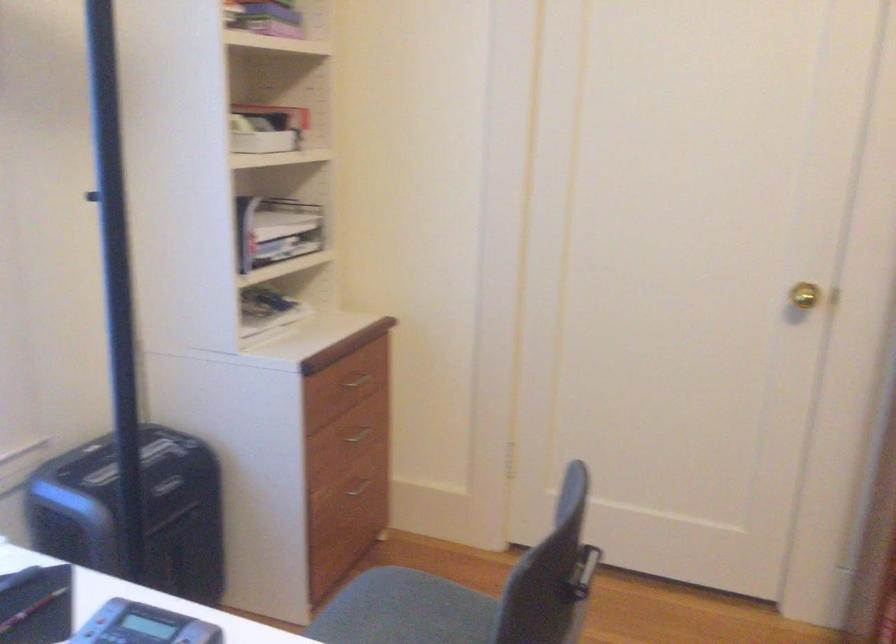
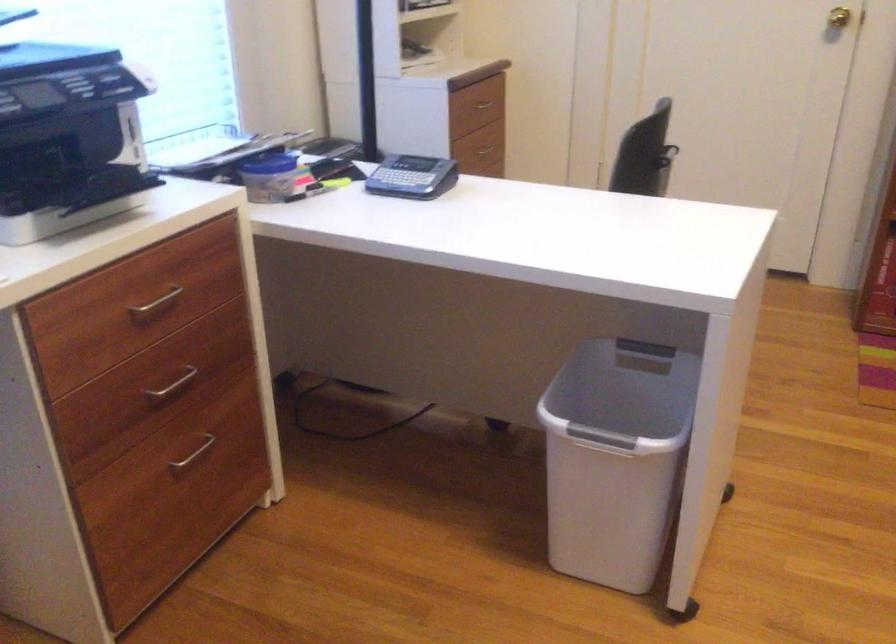
Locate, in the second image, the point that corresponds to (814,279) in the first image.

(839, 17)